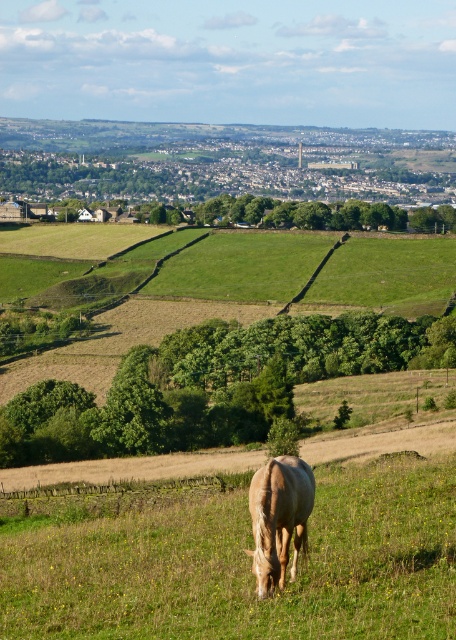
You are standing in the middle of the green grassy field at center and want to see the light brown horse at center. Considering the height difference between them, will the horse be visible from your current position?

The green grassy field at center has a greater height compared to the light brown horse at center, so the horse may be partially or fully obscured by the tall grass, making it less visible from your current position.

You are a farmer checking the pasture conditions. You notice the green grassy field at center and the light brown horse at center. Which area is wider when viewed from above?

The green grassy field at center is wider than the light brown horse at center.

Consider the image. You are standing in the middle of the green grassy field at center and want to approach the light brown horse at center. Which direction should you move to get closer to the horse?

Since the green grassy field at center is closer to the viewer than the light brown horse at center, you should move forward towards the horse as it is located further away in the background.